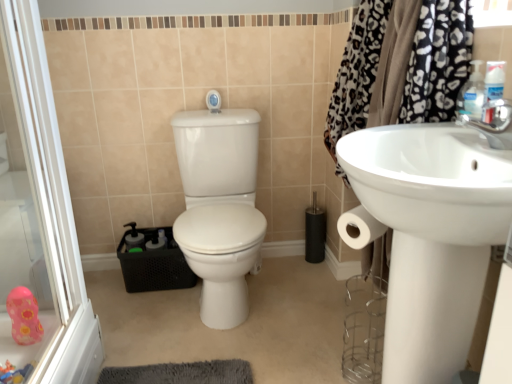
You are a GUI agent. You are given a task and a screenshot of the screen. Output one action in this format:
    pyautogui.click(x=<x>, y=<y>)
    Task: Click on the empty space that is ontop of pink rubber duck at lower left (from a real-world perspective)
    The width and height of the screenshot is (512, 384).
    Given the screenshot: What is the action you would take?
    pyautogui.click(x=204, y=335)